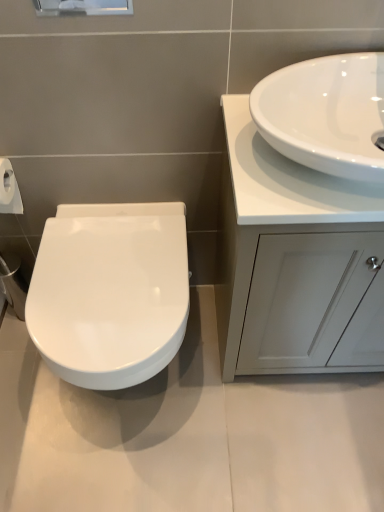
Question: From a real-world perspective, is white glossy cabinet at right physically above white glossy sink at upper right?

Choices:
 (A) no
 (B) yes

Answer: (A)

Question: Can you confirm if white glossy cabinet at right is positioned to the left of white glossy sink at upper right?

Choices:
 (A) yes
 (B) no

Answer: (B)

Question: Would you say white glossy cabinet at right is outside white glossy sink at upper right?

Choices:
 (A) yes
 (B) no

Answer: (A)

Question: Are white glossy cabinet at right and white glossy sink at upper right beside each other?

Choices:
 (A) yes
 (B) no

Answer: (B)

Question: Can you confirm if white glossy cabinet at right is smaller than white glossy sink at upper right?

Choices:
 (A) no
 (B) yes

Answer: (A)

Question: Does white glossy cabinet at right have a lesser height compared to white glossy sink at upper right?

Choices:
 (A) no
 (B) yes

Answer: (A)

Question: Is white glossy sink at upper right bigger than white glossy toilet at left?

Choices:
 (A) yes
 (B) no

Answer: (B)

Question: Can you confirm if white glossy sink at upper right is smaller than white glossy toilet at left?

Choices:
 (A) yes
 (B) no

Answer: (A)

Question: Is white glossy sink at upper right facing towards white glossy toilet at left?

Choices:
 (A) no
 (B) yes

Answer: (A)

Question: Is the position of white glossy sink at upper right less distant than that of white glossy toilet at left?

Choices:
 (A) no
 (B) yes

Answer: (B)

Question: From a real-world perspective, is white glossy sink at upper right located higher than white glossy toilet at left?

Choices:
 (A) no
 (B) yes

Answer: (B)

Question: From a real-world perspective, is white glossy sink at upper right positioned under white glossy toilet at left based on gravity?

Choices:
 (A) no
 (B) yes

Answer: (A)

Question: Is white glossy sink at upper right further to camera compared to white glossy cabinet at right?

Choices:
 (A) yes
 (B) no

Answer: (B)